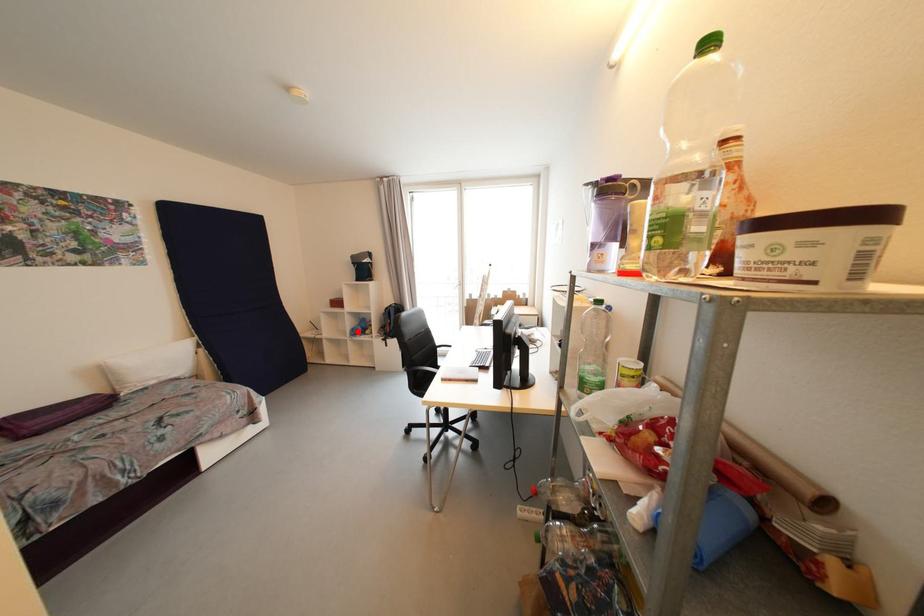
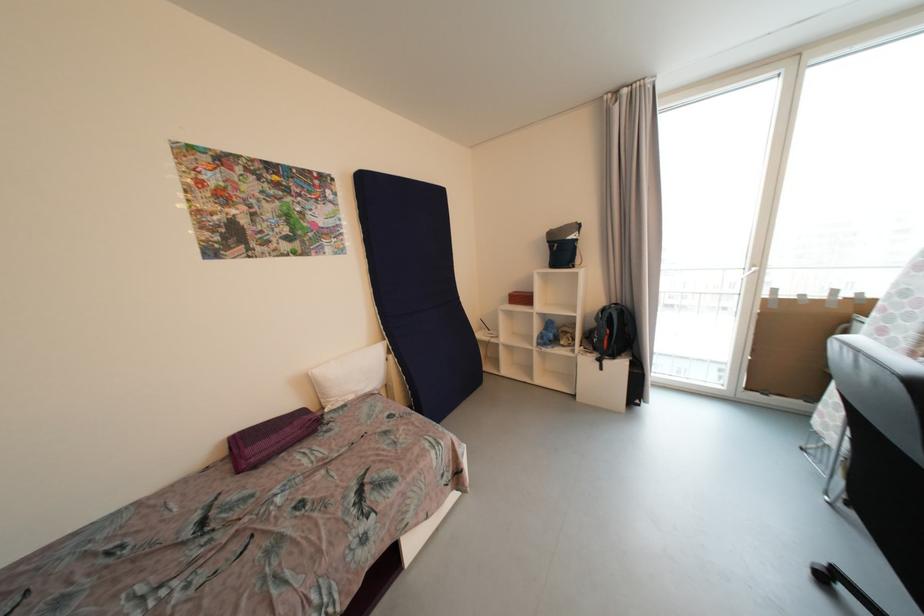
Question: A red point is marked in image1. In image2, is the corresponding 3D point closer to the camera or farther? Reply with the corresponding letter.

Choices:
 (A) The corresponding 3D point is closer.
 (B) The corresponding 3D point is farther.

Answer: (B)